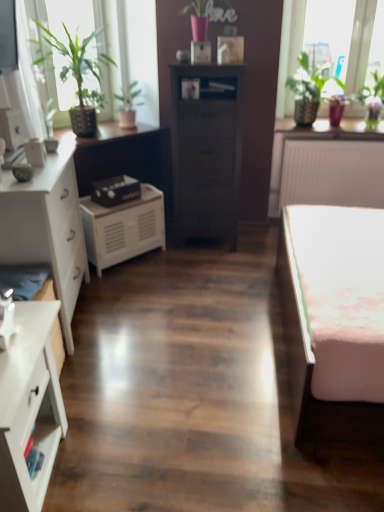
Locate an element on the screen. The image size is (384, 512). vacant location behind white glossy chest of drawers at lower left, positioned as the second chest of drawers in left-to-right order is located at coordinates (94, 385).